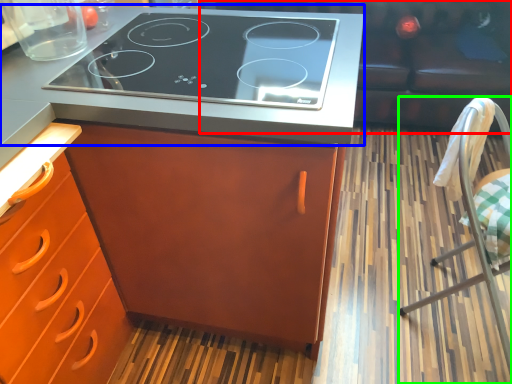
Question: Which object is the farthest from couch (highlighted by a red box)? Choose among these: countertop (highlighted by a blue box) or chair (highlighted by a green box).

Choices:
 (A) countertop
 (B) chair

Answer: (A)